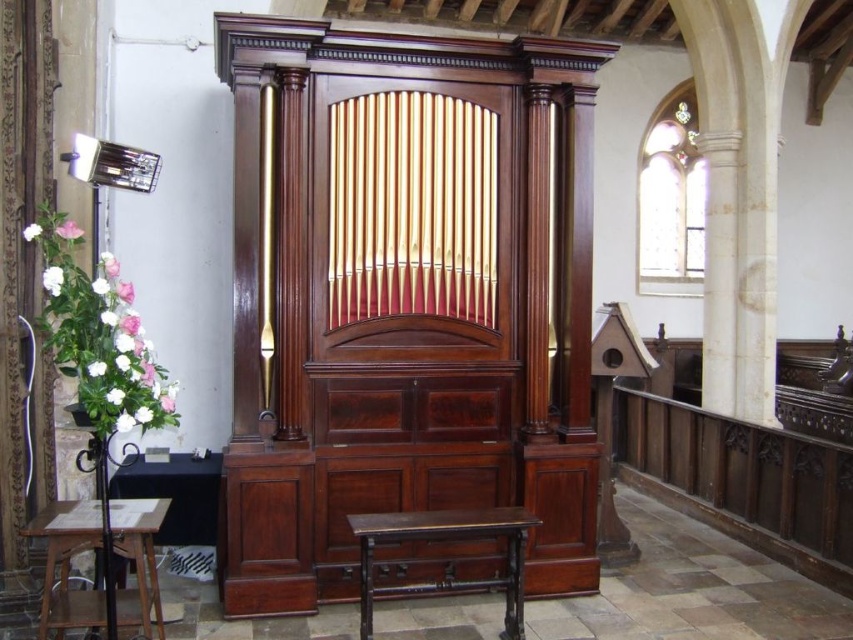
Question: Can you confirm if mahogany wood organ at center is positioned to the left of dark brown wooden stool at center?

Choices:
 (A) no
 (B) yes

Answer: (B)

Question: Which of the following is the farthest from the observer?

Choices:
 (A) wooden stool at lower left
 (B) mahogany wood organ at center

Answer: (B)

Question: Which of these objects is positioned farthest from the dark brown wooden stool at center?

Choices:
 (A) wooden stool at lower left
 (B) mahogany wood organ at center

Answer: (A)

Question: Is dark brown wooden stool at center in front of wooden stool at lower left?

Choices:
 (A) no
 (B) yes

Answer: (A)

Question: Is mahogany wood organ at center below wooden stool at lower left?

Choices:
 (A) yes
 (B) no

Answer: (B)

Question: Which point is closer to the camera?

Choices:
 (A) wooden stool at lower left
 (B) mahogany wood organ at center

Answer: (A)